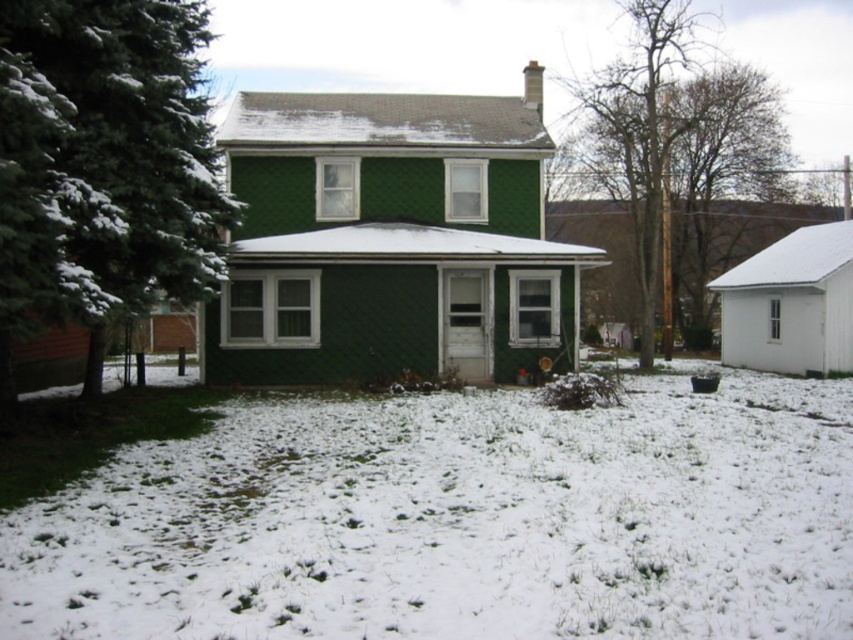
You are a delivery person trying to deliver a package to the house. You notice the white fluffy snow at center and the bare wood pole at upper right. Which object is closer to you as you approach the house?

The white fluffy snow at center is closer to you because it is in front of the bare wood pole at upper right.